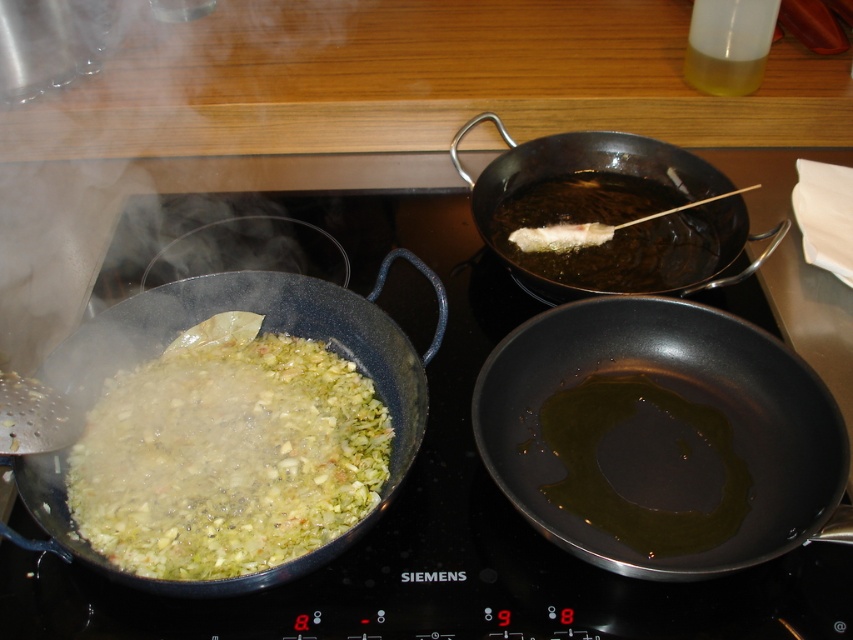
Question: Is shiny black pan at lower right bigger than shiny black wok at lower left?

Choices:
 (A) no
 (B) yes

Answer: (A)

Question: Which object appears farthest from the camera in this image?

Choices:
 (A) shiny black pan at lower right
 (B) shiny black wok at upper right

Answer: (B)

Question: From the image, what is the correct spatial relationship of shiny black pan at lower right in relation to shiny black wok at lower left?

Choices:
 (A) above
 (B) below

Answer: (B)

Question: Which object appears farthest from the camera in this image?

Choices:
 (A) shiny black wok at lower left
 (B) shiny black wok at upper right

Answer: (B)

Question: From the image, what is the correct spatial relationship of shiny black pan at lower right in relation to shiny black wok at lower left?

Choices:
 (A) right
 (B) left

Answer: (A)

Question: Which point is farther to the camera?

Choices:
 (A) shiny black pan at lower right
 (B) shiny black wok at lower left
 (C) shiny black wok at upper right

Answer: (C)